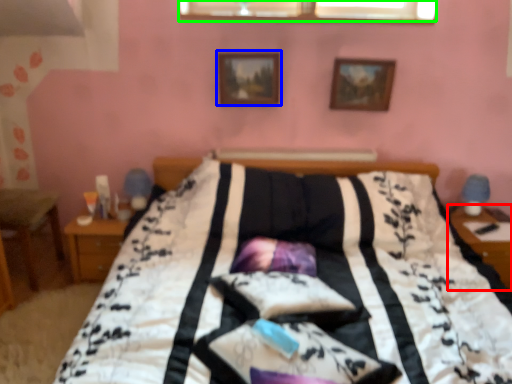
Question: Which object is positioned farthest from table (highlighted by a red box)? Select from picture frame (highlighted by a blue box) and window (highlighted by a green box).

Choices:
 (A) picture frame
 (B) window

Answer: (A)